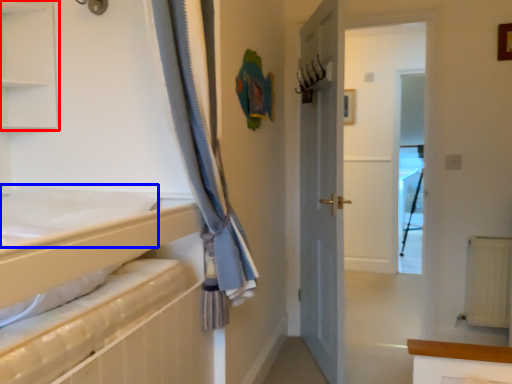
Question: Which point is further to the camera, shelf (highlighted by a red box) or sheet (highlighted by a blue box)?

Choices:
 (A) shelf
 (B) sheet

Answer: (A)